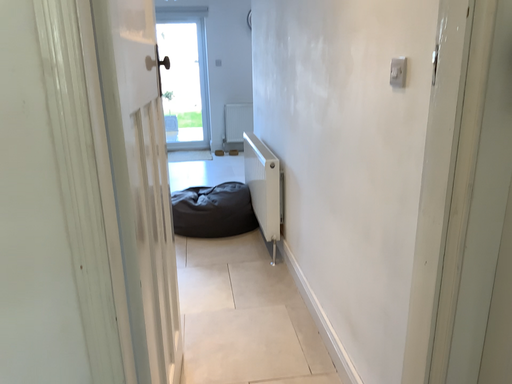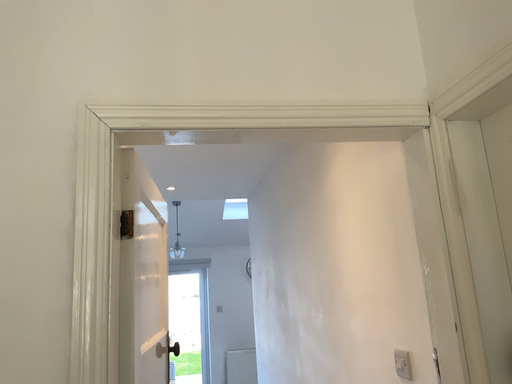
Question: How did the camera likely rotate when shooting the video?

Choices:
 (A) rotated downward
 (B) rotated upward

Answer: (B)